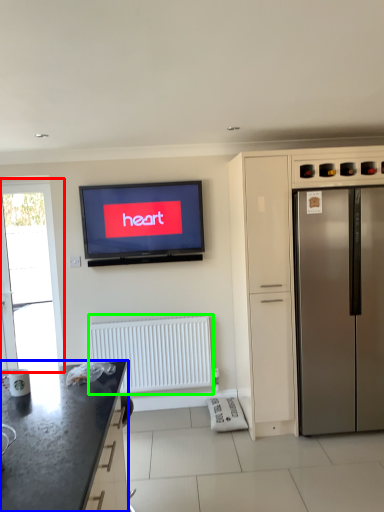
Question: Which is farther away from window screen (highlighted by a red box)? countertop (highlighted by a blue box) or radiator (highlighted by a green box)?

Choices:
 (A) countertop
 (B) radiator

Answer: (A)